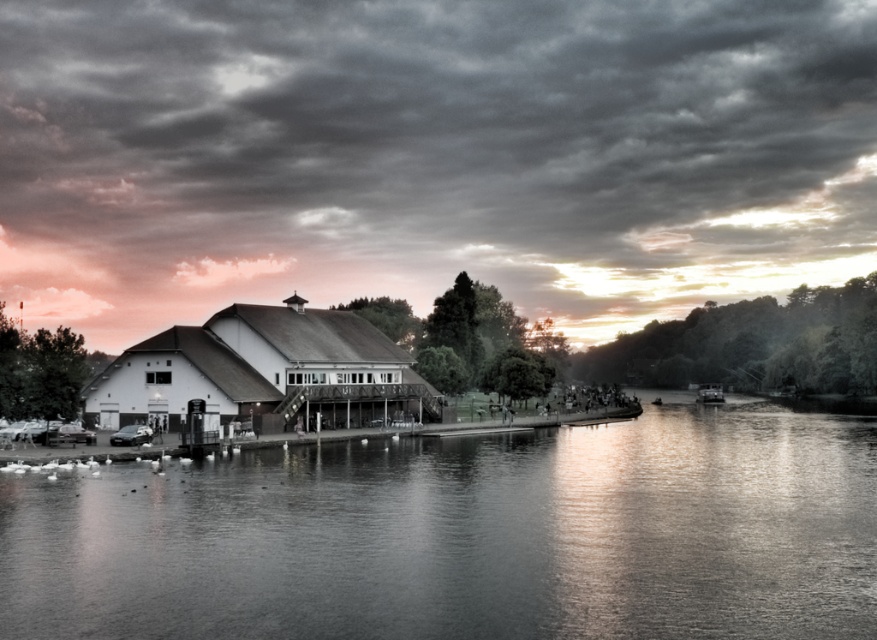
Question: Is cloudy sky at upper center wider than metallic silver boat at right?

Choices:
 (A) no
 (B) yes

Answer: (B)

Question: Is the position of cloudy sky at upper center less distant than that of metallic silver boat at right?

Choices:
 (A) no
 (B) yes

Answer: (A)

Question: Which of the following is the closest to the observer?

Choices:
 (A) metallic silver boat at right
 (B) cloudy sky at upper center
 (C) smooth water at center

Answer: (C)

Question: Among these objects, which one is nearest to the camera?

Choices:
 (A) cloudy sky at upper center
 (B) smooth water at center
 (C) metallic silver boat at right

Answer: (B)

Question: Considering the real-world distances, which object is farthest from the metallic silver boat at right?

Choices:
 (A) smooth water at center
 (B) cloudy sky at upper center

Answer: (B)

Question: Is cloudy sky at upper center above metallic silver boat at right?

Choices:
 (A) no
 (B) yes

Answer: (B)